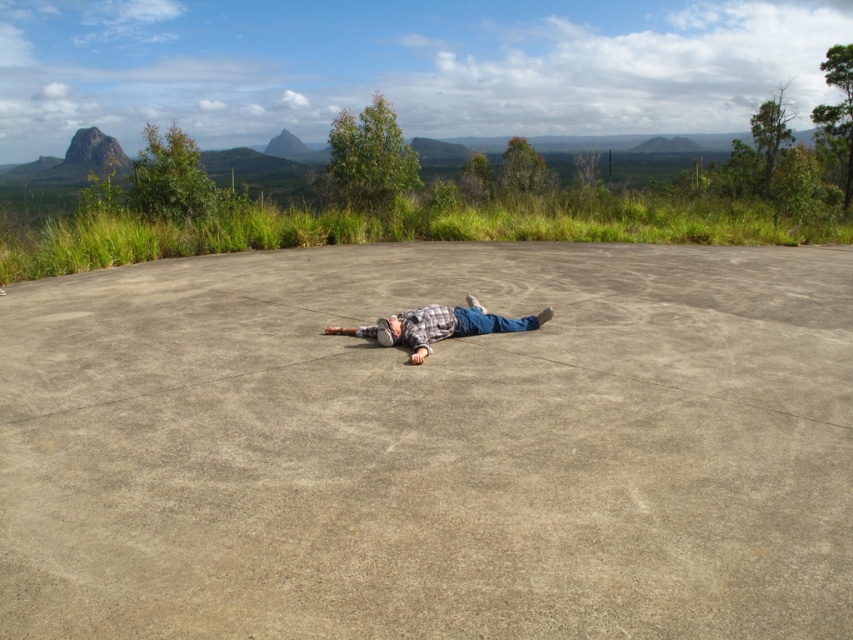
Based on the photo, you are a photographer trying to capture a shot of the gray concrete at center and the plaid shirt at center. Since both are in the same scene, which one would appear closer to the camera in the photo?

The gray concrete at center appears closer to the camera because it is positioned in front of the plaid shirt at center in the scene.